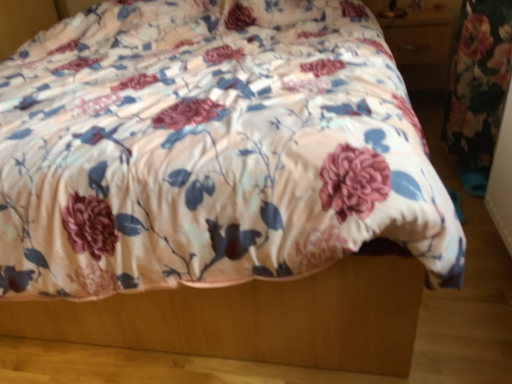
Describe the element at coordinates (418, 42) in the screenshot. I see `wooden drawer at upper right` at that location.

The height and width of the screenshot is (384, 512). What are the coordinates of `wooden drawer at upper right` in the screenshot? It's located at (418, 42).

Find the location of `floral fabric bed at center`. floral fabric bed at center is located at coordinates (210, 149).

Image resolution: width=512 pixels, height=384 pixels. Describe the element at coordinates (210, 149) in the screenshot. I see `floral fabric bed at center` at that location.

What is the approximate width of floral fabric bed at center?

It is 2.35 meters.

Identify the location of wooden drawer at upper right. (418, 42).

Based on their positions, is wooden drawer at upper right located to the left or right of floral fabric bed at center?

Based on their positions, wooden drawer at upper right is located to the right of floral fabric bed at center.

Based on the photo, in the image, is wooden drawer at upper right positioned in front of or behind floral fabric bed at center?

wooden drawer at upper right is positioned farther from the viewer than floral fabric bed at center.

Which is nearer, (404,32) or (315,102)?

The point (315,102) is in front.

From the image's perspective, is wooden drawer at upper right below floral fabric bed at center?

No, from the image's perspective, wooden drawer at upper right is not beneath floral fabric bed at center.

From a real-world perspective, which object stands above the other?

wooden drawer at upper right, from a real-world perspective.

Can you confirm if wooden drawer at upper right is wider than floral fabric bed at center?

Incorrect, the width of wooden drawer at upper right does not surpass that of floral fabric bed at center.

Which of these two, wooden drawer at upper right or floral fabric bed at center, stands taller?

floral fabric bed at center is taller.

Can you confirm if wooden drawer at upper right is bigger than floral fabric bed at center?

Incorrect, wooden drawer at upper right is not larger than floral fabric bed at center.

Is wooden drawer at upper right not inside floral fabric bed at center?

Absolutely, wooden drawer at upper right is external to floral fabric bed at center.

Is wooden drawer at upper right positioned far away from floral fabric bed at center?

wooden drawer at upper right is far away from floral fabric bed at center.

Is wooden drawer at upper right facing away from floral fabric bed at center?

wooden drawer at upper right is not turned away from floral fabric bed at center.

Image resolution: width=512 pixels, height=384 pixels. In order to click on bed on the left of the wooden drawer at upper right in this screenshot , I will do `click(210, 149)`.

Considering the positions of objects floral fabric bed at center and wooden drawer at upper right in the image provided, who is more to the right, floral fabric bed at center or wooden drawer at upper right?

Positioned to the right is wooden drawer at upper right.

Which object is more forward, floral fabric bed at center or wooden drawer at upper right?

floral fabric bed at center is more forward.

Between point (157, 107) and point (435, 25), which one is positioned in front?

Point (157, 107)

Looking at this image, from the image's perspective, which one is positioned lower, floral fabric bed at center or wooden drawer at upper right?

From the image's view, floral fabric bed at center is below.

From a real-world perspective, between floral fabric bed at center and wooden drawer at upper right, who is vertically lower?

From a 3D spatial view, floral fabric bed at center is below.

Which of these two, floral fabric bed at center or wooden drawer at upper right, is wider?

floral fabric bed at center.

Considering the sizes of floral fabric bed at center and wooden drawer at upper right in the image, is floral fabric bed at center taller or shorter than wooden drawer at upper right?

In the image, floral fabric bed at center appears to be taller than wooden drawer at upper right.

Does floral fabric bed at center have a smaller size compared to wooden drawer at upper right?

No, floral fabric bed at center is not smaller than wooden drawer at upper right.

Is floral fabric bed at center spatially inside wooden drawer at upper right, or outside of it?

floral fabric bed at center lies outside wooden drawer at upper right.

Is floral fabric bed at center far from wooden drawer at upper right?

floral fabric bed at center is positioned a significant distance from wooden drawer at upper right.

Is wooden drawer at upper right at the back of floral fabric bed at center?

No, floral fabric bed at center is not facing away from wooden drawer at upper right.

Where is `bed lying below the wooden drawer at upper right (from the image's perspective)`? The image size is (512, 384). bed lying below the wooden drawer at upper right (from the image's perspective) is located at coordinates (210, 149).

Image resolution: width=512 pixels, height=384 pixels. Find the location of `bed on the left side of wooden drawer at upper right`. bed on the left side of wooden drawer at upper right is located at coordinates (210, 149).

There is a floral fabric bed at center. Where is `drawer above it (from a real-world perspective)`? The width and height of the screenshot is (512, 384). drawer above it (from a real-world perspective) is located at coordinates [x=418, y=42].